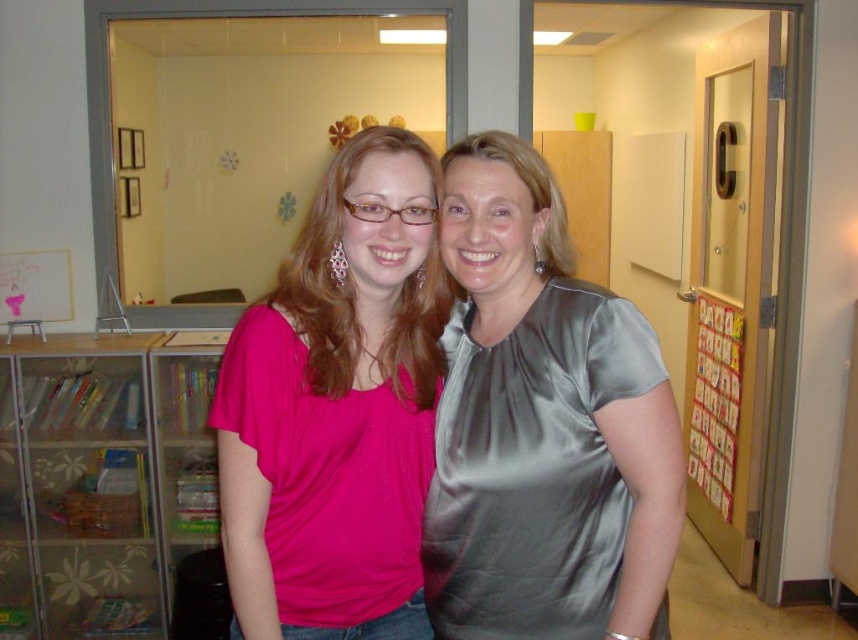
You are an interior designer working on a layout for a space similar to the one shown. You need to place a new decorative item exactly where the pink satin blouse at center is currently located. What coordinates should you use for placement?

The coordinates for the pink satin blouse at center are at point (337, 406), so you should place the decorative item there.

You are standing in the room and want to take a photo of the pink satin blouse at center. Where should you aim your camera to capture it?

The pink satin blouse at center is located at the 2D coordinates point (337, 406), so aim your camera there to capture it.

You are standing in the classroom and want to walk from point A to point B. Point A is at coordinate point (411,508) and point B is at coordinate point (137,470). Will you walk towards the direction of the glass partition with snowflake cutouts or away from it while moving from A to B?

Since point (411,508) is in front of point (137,470), moving from A to B would mean walking away from the glass partition with snowflake cutouts.